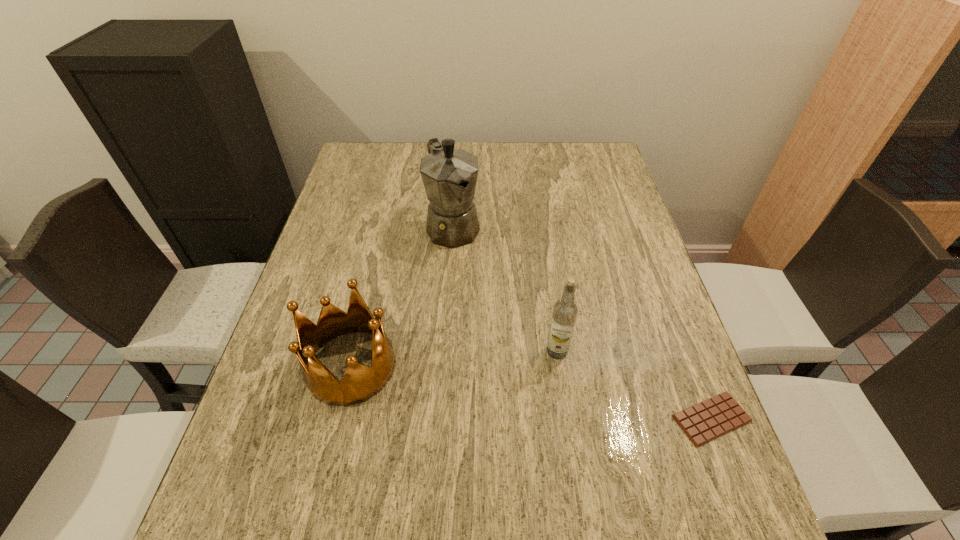
The height and width of the screenshot is (540, 960). Identify the location of the leftmost object. (359, 383).

Find the location of a particular element. This screenshot has height=540, width=960. the second shortest object is located at coordinates (359, 383).

You are a GUI agent. You are given a task and a screenshot of the screen. Output one action in this format:
    pyautogui.click(x=<x>, y=<y>)
    Task: Click on the rightmost object
    The image size is (960, 540).
    Given the screenshot: What is the action you would take?
    pyautogui.click(x=714, y=417)

At what (x,y) coordinates should I click in order to perform the action: click on the shortest object. Please return your answer as a coordinate pair (x, y). The image size is (960, 540). Looking at the image, I should click on (714, 417).

Where is `the third object from right to left`? Image resolution: width=960 pixels, height=540 pixels. the third object from right to left is located at coordinates tap(449, 175).

Identify the location of the tallest object. Image resolution: width=960 pixels, height=540 pixels. (449, 175).

The height and width of the screenshot is (540, 960). Identify the location of the third shortest object. (565, 311).

In order to click on vodka in this screenshot , I will do `click(565, 311)`.

Image resolution: width=960 pixels, height=540 pixels. In order to click on vacant point located 0.240m on the right of the crown in this screenshot , I will do `click(508, 366)`.

Find the location of a particular element. The image size is (960, 540). blank space located 0.110m on the left of the candy bar is located at coordinates (616, 418).